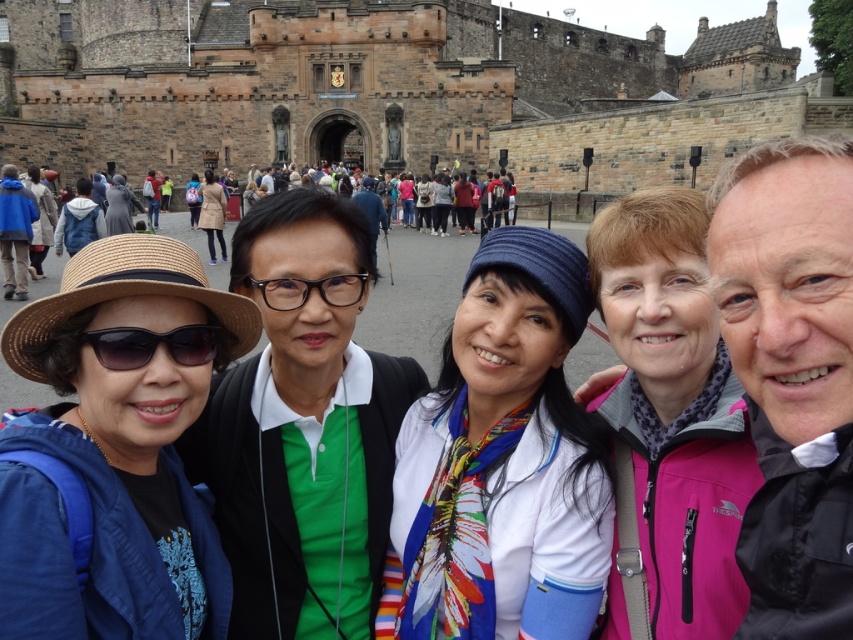
Is sunglasses at left taller than transparent plastic glasses at center?

No, sunglasses at left is not taller than transparent plastic glasses at center.

Which is more to the left, sunglasses at left or transparent plastic glasses at center?

sunglasses at left

Between point (207, 332) and point (276, 298), which one is positioned behind?

Positioned behind is point (276, 298).

Identify the location of sunglasses at left. (157, 344).